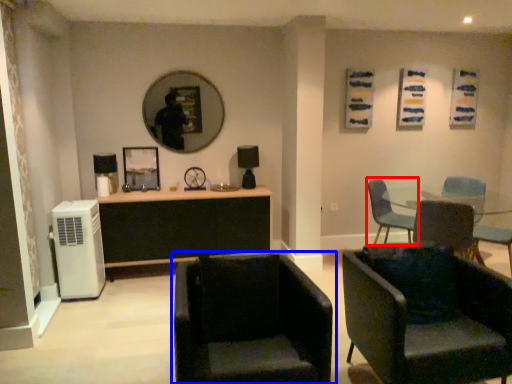
Question: Among these objects, which one is farthest to the camera, chair (highlighted by a red box) or chair (highlighted by a blue box)?

Choices:
 (A) chair
 (B) chair

Answer: (A)